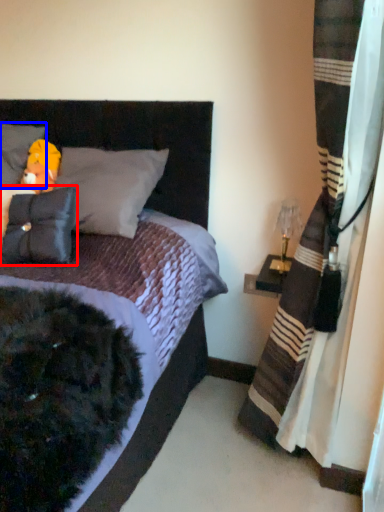
Question: Among these objects, which one is nearest to the camera, pillow (highlighted by a red box) or pillow (highlighted by a blue box)?

Choices:
 (A) pillow
 (B) pillow

Answer: (A)